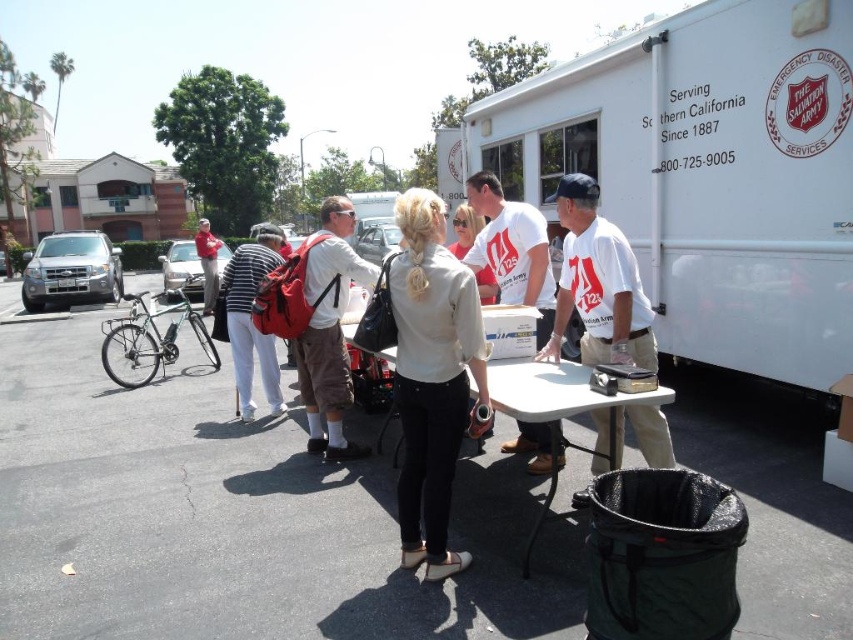
Question: Based on their relative distances, which object is farther from the white plastic picnic table at center?

Choices:
 (A) red shirt at center
 (B) white cotton t-shirt at center

Answer: (A)

Question: In this image, where is matte white blouse at center located relative to white cotton shirt at center?

Choices:
 (A) right
 (B) left

Answer: (B)

Question: Does white cotton shirt at center appear on the right side of striped cotton shirt at center?

Choices:
 (A) yes
 (B) no

Answer: (A)

Question: Which point is closer to the camera?

Choices:
 (A) white matte truck at center
 (B) white matte shirt at center

Answer: (A)

Question: Which is nearer to the striped cotton shirt at center?

Choices:
 (A) white plastic picnic table at center
 (B) white cotton t-shirt at center

Answer: (A)

Question: Does matte red backpack at center appear on the left side of white plastic picnic table at center?

Choices:
 (A) yes
 (B) no

Answer: (A)